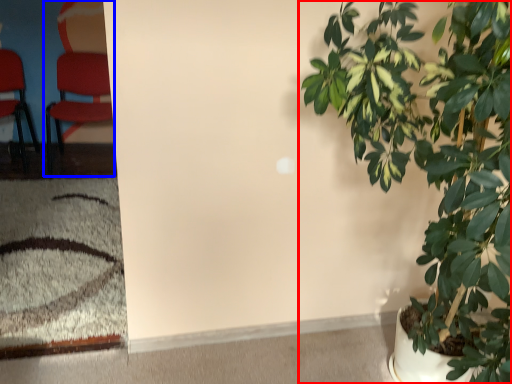
Question: Which of the following is the farthest to the observer, houseplant (highlighted by a red box) or chair (highlighted by a blue box)?

Choices:
 (A) houseplant
 (B) chair

Answer: (B)